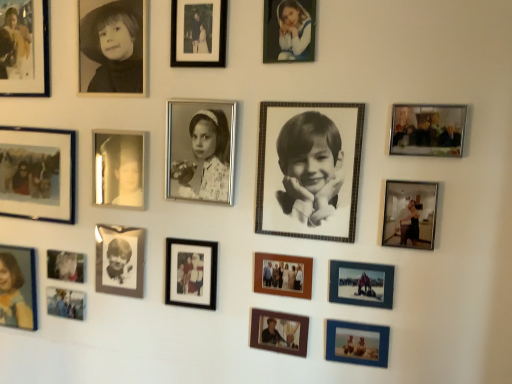
What is the approximate height of matte black photo frame at upper left, acting as the 1th picture frame starting from the left?

The height of matte black photo frame at upper left, acting as the 1th picture frame starting from the left, is 42.08 centimeters.

What do you see at coordinates (66, 303) in the screenshot? I see `metallic silver photo frame at lower left, the twelfth picture frame positioned from the right` at bounding box center [66, 303].

The image size is (512, 384). What do you see at coordinates (191, 273) in the screenshot? I see `matte black photo frame at center, acting as the 8th picture frame starting from the right` at bounding box center [191, 273].

Describe the element at coordinates (66, 266) in the screenshot. I see `metallic silver photo frame at lower left, acting as the 4th picture frame starting from the left` at that location.

Image resolution: width=512 pixels, height=384 pixels. Find the location of `matte wooden photo frame at left, which is the 2th picture frame from left to right`. matte wooden photo frame at left, which is the 2th picture frame from left to right is located at coordinates (38, 174).

I want to click on metallic reflective photo frame at center-left, which is the 6th picture frame in left-to-right order, so click(x=118, y=169).

This screenshot has height=384, width=512. In order to click on black paper at upper left, the 2th person viewed from the left in this screenshot , I will do `click(113, 48)`.

Is matte black photo frame at upper left, acting as the 1th picture frame starting from the left, oriented away from blue textured photo frame at lower right, the fourth picture frame when ordered from right to left?

No, matte black photo frame at upper left, acting as the 1th picture frame starting from the left, is not facing away from blue textured photo frame at lower right, the fourth picture frame when ordered from right to left.

Visually, is matte black photo frame at upper left, acting as the 1th picture frame starting from the left, positioned to the left or to the right of blue textured photo frame at lower right, the fourth picture frame when ordered from right to left?

Clearly, matte black photo frame at upper left, acting as the 1th picture frame starting from the left, is on the left of blue textured photo frame at lower right, the fourth picture frame when ordered from right to left, in the image.

Is matte black photo frame at upper left, marked as the 14th picture frame in a right-to-left arrangement, positioned beyond the bounds of blue textured photo frame at lower right, which appears as the eleventh picture frame when viewed from the left?

Indeed, matte black photo frame at upper left, marked as the 14th picture frame in a right-to-left arrangement, is completely outside blue textured photo frame at lower right, which appears as the eleventh picture frame when viewed from the left.

Does matte black photo frame at upper left, marked as the 14th picture frame in a right-to-left arrangement, touch blue textured photo frame at lower right, the fourth picture frame when ordered from right to left?

There is a gap between matte black photo frame at upper left, marked as the 14th picture frame in a right-to-left arrangement, and blue textured photo frame at lower right, the fourth picture frame when ordered from right to left.

Based on the photo, is matte black photo frame at upper center, which ranks as the 7th picture frame in right-to-left order, facing away from black paper at upper left, arranged as the 4th person when viewed from the right?

No, black paper at upper left, arranged as the 4th person when viewed from the right, is not at the back of matte black photo frame at upper center, which ranks as the 7th picture frame in right-to-left order.

Would you say matte black photo frame at upper center, which ranks as the 7th picture frame in right-to-left order, is inside or outside black paper at upper left, arranged as the 4th person when viewed from the right?

matte black photo frame at upper center, which ranks as the 7th picture frame in right-to-left order, is located beyond the bounds of black paper at upper left, arranged as the 4th person when viewed from the right.

Are matte black photo frame at upper center, which ranks as the 7th picture frame in right-to-left order, and black paper at upper left, arranged as the 4th person when viewed from the right, far apart?

No, matte black photo frame at upper center, which ranks as the 7th picture frame in right-to-left order, is not far from black paper at upper left, arranged as the 4th person when viewed from the right.

Does point (400, 201) lie behind point (102, 16)?

No.

From a real-world perspective, is metallic silver photo frame at right, placed as the 13th picture frame when sorted from left to right, positioned above or below black paper at upper left, the second person when ordered from back to front?

In terms of real-world spatial position, metallic silver photo frame at right, placed as the 13th picture frame when sorted from left to right, is below black paper at upper left, the second person when ordered from back to front.

Is metallic silver photo frame at right, which ranks as the 2th picture frame in right-to-left order, thinner than black paper at upper left, the 2th person viewed from the left?

Yes.

Starting from the metallic silver photo frame at right, placed as the 13th picture frame when sorted from left to right, which person is the 4th one behind? Please provide its 2D coordinates.

[(113, 48)]

From their relative heights in the image, would you say blue textured photo frame at lower right, the fourth picture frame when ordered from right to left, is taller or shorter than black glossy photo frame at lower left, placed as the fifth picture frame when sorted from left to right?

In the image, blue textured photo frame at lower right, the fourth picture frame when ordered from right to left, appears to be shorter than black glossy photo frame at lower left, placed as the fifth picture frame when sorted from left to right.

Measure the distance from blue textured photo frame at lower right, which appears as the eleventh picture frame when viewed from the left, to black glossy photo frame at lower left, placed as the fifth picture frame when sorted from left to right.

A distance of 28.19 inches exists between blue textured photo frame at lower right, which appears as the eleventh picture frame when viewed from the left, and black glossy photo frame at lower left, placed as the fifth picture frame when sorted from left to right.

Can we say blue textured photo frame at lower right, the fourth picture frame when ordered from right to left, lies outside black glossy photo frame at lower left, which is counted as the 10th picture frame, starting from the right?

That's correct, blue textured photo frame at lower right, the fourth picture frame when ordered from right to left, is outside of black glossy photo frame at lower left, which is counted as the 10th picture frame, starting from the right.

Which point is more forward, (380, 359) or (129, 267)?

The point (380, 359) is in front.

Which is closer, (134, 11) or (188, 13)?

Clearly, point (134, 11) is more distant from the camera than point (188, 13).

Is black paper at upper left, the 2th person viewed from the left, looking in the opposite direction of matte black photo frame at upper center, which ranks as the 7th picture frame in right-to-left order?

No.

Would you say black paper at upper left, arranged as the 4th person when viewed from the right, is a long distance from matte black photo frame at upper center, placed as the eighth picture frame when sorted from left to right?

black paper at upper left, arranged as the 4th person when viewed from the right, is near matte black photo frame at upper center, placed as the eighth picture frame when sorted from left to right, not far away.

At what (x,y) coordinates should I click in order to perform the action: click on picture frame that is the 1st one when counting upward from the black paper at upper left, the 2th person viewed from the left (from the image's perspective). Please return your answer as a coordinate pair (x, y). The width and height of the screenshot is (512, 384). Looking at the image, I should click on click(198, 33).

Is matte white dress at upper center, marked as the first person in a front-to-back arrangement, completely or partially inside black glossy photo frame at lower left, placed as the fifth picture frame when sorted from left to right?

No, matte white dress at upper center, marked as the first person in a front-to-back arrangement, is not a part of black glossy photo frame at lower left, placed as the fifth picture frame when sorted from left to right.

Between black glossy photo frame at lower left, which is counted as the 10th picture frame, starting from the right, and matte white dress at upper center, the 2th person from the right, which one has larger size?

With larger size is black glossy photo frame at lower left, which is counted as the 10th picture frame, starting from the right.

Is black glossy photo frame at lower left, which is counted as the 10th picture frame, starting from the right, aimed at matte white dress at upper center, marked as the 4th person in a left-to-right arrangement?

No, black glossy photo frame at lower left, which is counted as the 10th picture frame, starting from the right, is not turned towards matte white dress at upper center, marked as the 4th person in a left-to-right arrangement.

Would you consider black glossy photo frame at lower left, placed as the fifth picture frame when sorted from left to right, to be distant from matte white dress at upper center, which ranks as the 5th person in back-to-front order?

No, black glossy photo frame at lower left, placed as the fifth picture frame when sorted from left to right, is in close proximity to matte white dress at upper center, which ranks as the 5th person in back-to-front order.

Is wooden photo frame at center, positioned as the 6th picture frame in right-to-left order, turned away from black glossy photo frame at lower left, placed as the fifth picture frame when sorted from left to right?

No, wooden photo frame at center, positioned as the 6th picture frame in right-to-left order, is not facing the opposite direction of black glossy photo frame at lower left, placed as the fifth picture frame when sorted from left to right.

Considering the relative positions of wooden photo frame at center, positioned as the 6th picture frame in right-to-left order, and black glossy photo frame at lower left, placed as the fifth picture frame when sorted from left to right, in the image provided, is wooden photo frame at center, positioned as the 6th picture frame in right-to-left order, to the left or to the right of black glossy photo frame at lower left, placed as the fifth picture frame when sorted from left to right,?

In the image, wooden photo frame at center, positioned as the 6th picture frame in right-to-left order, appears on the right side of black glossy photo frame at lower left, placed as the fifth picture frame when sorted from left to right.

Which of these two, wooden photo frame at center, placed as the 9th picture frame when sorted from left to right, or black glossy photo frame at lower left, which is counted as the 10th picture frame, starting from the right, stands taller?

black glossy photo frame at lower left, which is counted as the 10th picture frame, starting from the right, is taller.

Is wooden photo frame at center, placed as the 9th picture frame when sorted from left to right, inside the boundaries of black glossy photo frame at lower left, placed as the fifth picture frame when sorted from left to right, or outside?

The correct answer is: outside.

Starting from the blue textured photo frame at lower right, which appears as the eleventh picture frame when viewed from the left, which picture frame is the 10th one to the left? Please provide its 2D coordinates.

[(24, 48)]

Identify the location of the 1st picture frame above the black paper at upper left, the 2th person viewed from the left (from the image's perspective). The height and width of the screenshot is (384, 512). (198, 33).

From the image, which object appears to be nearer to metallic silver photo frame at lower left, the twelfth picture frame positioned from the right, metallic silver photo frame at lower left, placed as the eleventh picture frame when sorted from right to left, or matte white dress at upper center, marked as the 4th person in a left-to-right arrangement?

Based on the image, metallic silver photo frame at lower left, placed as the eleventh picture frame when sorted from right to left, appears to be nearer to metallic silver photo frame at lower left, the twelfth picture frame positioned from the right.

Looking at the image, which one is located further to metallic silver photo frame at lower left, placed as the eleventh picture frame when sorted from right to left, blue textured photo frame at lower right, the fourth picture frame when ordered from right to left, or matte white dress at upper center, marked as the 4th person in a left-to-right arrangement?

matte white dress at upper center, marked as the 4th person in a left-to-right arrangement, lies further to metallic silver photo frame at lower left, placed as the eleventh picture frame when sorted from right to left, than the other object.

From the image, which object appears to be farther from metallic silver photo frame at lower left, the 3th picture frame viewed from the left, matte black photo frame at upper left, acting as the 1th picture frame starting from the left, or metallic silver photo frame at upper right, which ranks as the first picture frame in right-to-left order?

metallic silver photo frame at upper right, which ranks as the first picture frame in right-to-left order, is positioned further to the anchor metallic silver photo frame at lower left, the 3th picture frame viewed from the left.

Consider the image. Estimate the real-world distances between objects in this image. Which object is further from matte blue dress at bottom left, placed as the 5th person when sorted from front to back, metallic silver photo frame at lower left, placed as the eleventh picture frame when sorted from right to left, or metallic silver photo frame at lower left, the 3th picture frame viewed from the left?

Among the two, metallic silver photo frame at lower left, placed as the eleventh picture frame when sorted from right to left, is located further to matte blue dress at bottom left, placed as the 5th person when sorted from front to back.

Considering their positions, is matte black photo frame at upper center, which ranks as the 7th picture frame in right-to-left order, positioned further to black paper at upper left, the 2th person viewed from the left, than wooden photo frame at center, positioned as the 6th picture frame in right-to-left order?

Among the two, wooden photo frame at center, positioned as the 6th picture frame in right-to-left order, is located further to black paper at upper left, the 2th person viewed from the left.

Which object lies further to the anchor point wooden photo frame at center, positioned as the 6th picture frame in right-to-left order, matte blue dress at bottom left, positioned as the fifth person in right-to-left order, or matte black photo frame at upper center, which ranks as the 7th picture frame in right-to-left order?

matte blue dress at bottom left, positioned as the fifth person in right-to-left order, lies further to wooden photo frame at center, positioned as the 6th picture frame in right-to-left order, than the other object.

Which object lies further to the anchor point wooden photo frame at center, arranged as the tenth picture frame when viewed from the left, metallic silver photo frame at lower left, acting as the 4th picture frame starting from the left, or black paper at upper left, the 2th person viewed from the left?

Among the two, black paper at upper left, the 2th person viewed from the left, is located further to wooden photo frame at center, arranged as the tenth picture frame when viewed from the left.

Based on their spatial positions, is wooden photo frame at center, placed as the 9th picture frame when sorted from left to right, or matte black photo frame at center, acting as the 8th picture frame starting from the right, closer to black glossy photo frame at center-left, the 3th person viewed from the right?

matte black photo frame at center, acting as the 8th picture frame starting from the right, is positioned closer to the anchor black glossy photo frame at center-left, the 3th person viewed from the right.

Where is `person between metallic reflective photo frame at center-left, which appears as the ninth picture frame when viewed from the right, and matte white dress at upper center, marked as the first person in a front-to-back arrangement, in the horizontal direction`? person between metallic reflective photo frame at center-left, which appears as the ninth picture frame when viewed from the right, and matte white dress at upper center, marked as the first person in a front-to-back arrangement, in the horizontal direction is located at coordinates (206, 158).

Where is `person between black glossy photo frame at lower left, which is counted as the 10th picture frame, starting from the right, and wooden photo frame at center, arranged as the tenth picture frame when viewed from the left, in the horizontal direction`? The width and height of the screenshot is (512, 384). person between black glossy photo frame at lower left, which is counted as the 10th picture frame, starting from the right, and wooden photo frame at center, arranged as the tenth picture frame when viewed from the left, in the horizontal direction is located at coordinates (206, 158).

Find the location of `person situated between matte wooden photo frame at left, arranged as the thirteenth picture frame when viewed from the right, and black glossy photo frame at center-left, the 3th person when ordered from back to front, from left to right`. person situated between matte wooden photo frame at left, arranged as the thirteenth picture frame when viewed from the right, and black glossy photo frame at center-left, the 3th person when ordered from back to front, from left to right is located at coordinates (113, 48).

Where is `person located between matte black photo frame at upper left, acting as the 1th picture frame starting from the left, and matte black photo frame at upper center, which ranks as the 7th picture frame in right-to-left order, in the left-right direction`? This screenshot has width=512, height=384. person located between matte black photo frame at upper left, acting as the 1th picture frame starting from the left, and matte black photo frame at upper center, which ranks as the 7th picture frame in right-to-left order, in the left-right direction is located at coordinates 113,48.